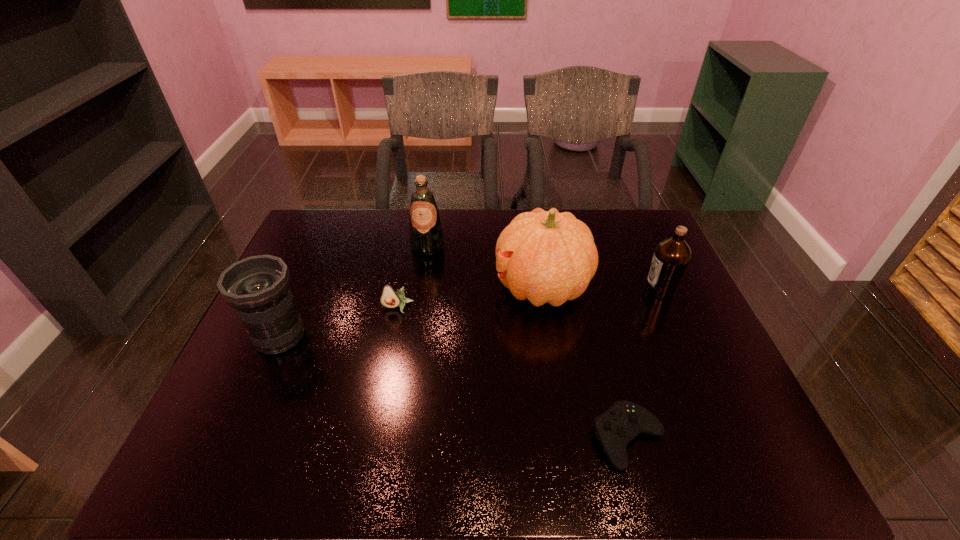
This screenshot has width=960, height=540. Find the location of `pumpkin`. pumpkin is located at coordinates (544, 256).

Locate an element on the screen. This screenshot has width=960, height=540. the farther olive oil is located at coordinates (426, 238).

This screenshot has height=540, width=960. Find the location of `the shorter olive oil`. the shorter olive oil is located at coordinates (671, 257).

Where is `the nearer olive oil`? The image size is (960, 540). the nearer olive oil is located at coordinates (671, 257).

At what (x,y) coordinates should I click in order to perform the action: click on telephoto lens. Please return your answer as a coordinate pair (x, y). The height and width of the screenshot is (540, 960). Looking at the image, I should click on (257, 287).

You are a GUI agent. You are given a task and a screenshot of the screen. Output one action in this format:
    pyautogui.click(x=<x>, y=<y>)
    Task: Click on the second shortest object
    This screenshot has width=960, height=540.
    Given the screenshot: What is the action you would take?
    pyautogui.click(x=390, y=298)

You are a GUI agent. You are given a task and a screenshot of the screen. Output one action in this format:
    pyautogui.click(x=<x>, y=<y>)
    Task: Click on the nearest object
    
    Given the screenshot: What is the action you would take?
    pyautogui.click(x=624, y=420)

Find the location of `control`. control is located at coordinates (624, 420).

Where is `vacant region located 0.330m on the carved face of the pumpkin`? vacant region located 0.330m on the carved face of the pumpkin is located at coordinates (382, 287).

Where is `free space located 0.150m on the carved face of the pumpkin`? free space located 0.150m on the carved face of the pumpkin is located at coordinates [444, 287].